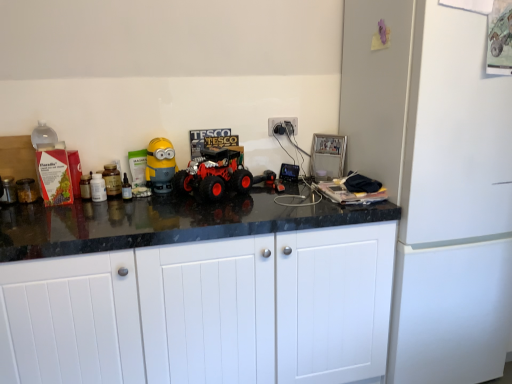
Question: Considering the relative positions of rubberized black toy truck at center, which ranks as the second toy in left-to-right order, and white matte refrigerator at right in the image provided, is rubberized black toy truck at center, which ranks as the second toy in left-to-right order, to the left of white matte refrigerator at right from the viewer's perspective?

Choices:
 (A) no
 (B) yes

Answer: (B)

Question: Considering the relative sizes of rubberized black toy truck at center, which is counted as the 1th toy, starting from the right, and white matte refrigerator at right in the image provided, is rubberized black toy truck at center, which is counted as the 1th toy, starting from the right, taller than white matte refrigerator at right?

Choices:
 (A) no
 (B) yes

Answer: (A)

Question: From the image's perspective, is rubberized black toy truck at center, which ranks as the second toy in left-to-right order, on white matte refrigerator at right?

Choices:
 (A) no
 (B) yes

Answer: (B)

Question: From the image's perspective, is rubberized black toy truck at center, which ranks as the second toy in left-to-right order, under white matte refrigerator at right?

Choices:
 (A) yes
 (B) no

Answer: (B)

Question: Does rubberized black toy truck at center, which ranks as the second toy in left-to-right order, turn towards white matte refrigerator at right?

Choices:
 (A) no
 (B) yes

Answer: (A)

Question: Can you confirm if rubberized black toy truck at center, which ranks as the second toy in left-to-right order, is shorter than white matte refrigerator at right?

Choices:
 (A) no
 (B) yes

Answer: (B)

Question: Can we say rubberized red toy truck at center lies outside yellow matte toy at center, which is the 1th toy in left-to-right order?

Choices:
 (A) yes
 (B) no

Answer: (A)

Question: Could you tell me if rubberized red toy truck at center is facing yellow matte toy at center, the second toy positioned from the right?

Choices:
 (A) yes
 (B) no

Answer: (B)

Question: Is rubberized red toy truck at center beside yellow matte toy at center, the second toy positioned from the right?

Choices:
 (A) no
 (B) yes

Answer: (A)

Question: Is the position of rubberized red toy truck at center less distant than that of yellow matte toy at center, which is the 1th toy in left-to-right order?

Choices:
 (A) yes
 (B) no

Answer: (A)

Question: From a real-world perspective, is rubberized red toy truck at center positioned under yellow matte toy at center, the second toy positioned from the right, based on gravity?

Choices:
 (A) yes
 (B) no

Answer: (A)

Question: Does rubberized red toy truck at center appear on the left side of yellow matte toy at center, which is the 1th toy in left-to-right order?

Choices:
 (A) no
 (B) yes

Answer: (A)

Question: Is white plastic electric outlet at upper right behind white matte refrigerator at right?

Choices:
 (A) yes
 (B) no

Answer: (A)